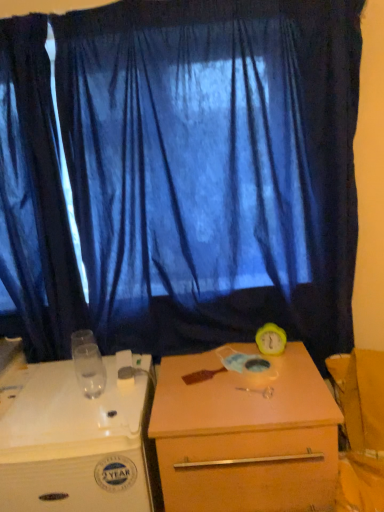
Identify the location of vacant space positioned to the left of yellow rubber alarm clock at right. (208, 365).